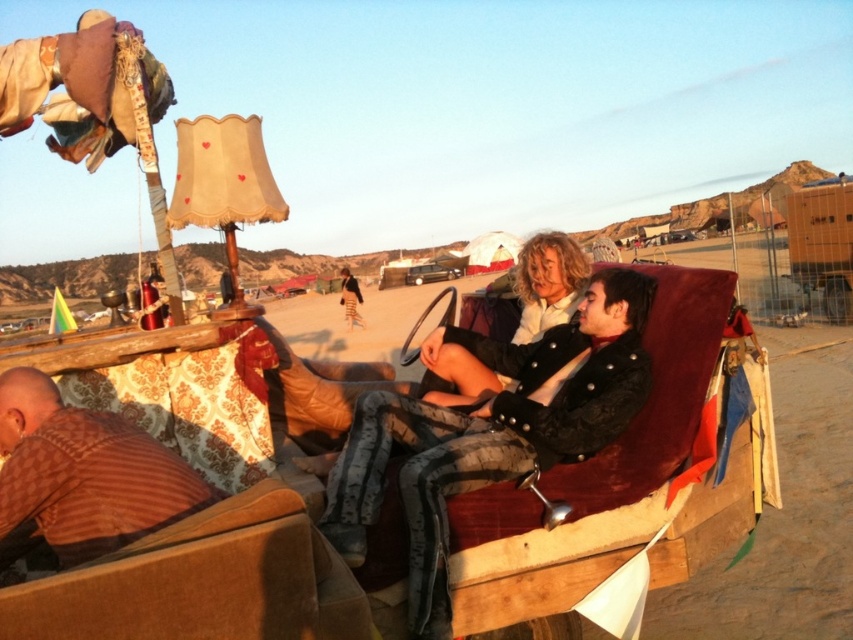
You are standing near the cart and want to hand a small gift to both the person wearing the brown striped shirt at lower left and the person in the matte black jacket at center. Which person would you need to reach down to give the gift to?

The brown striped shirt at lower left is shorter than the matte black jacket at center, so you would need to reach down to give the gift to the person wearing the brown striped shirt at lower left.

You are planning to move a brown striped shirt at lower left onto the velvet red couch at center. Will it fit on the couch?

The velvet red couch at center is wider than the brown striped shirt at lower left, so yes, the brown striped shirt at lower left will fit on the velvet red couch at center.